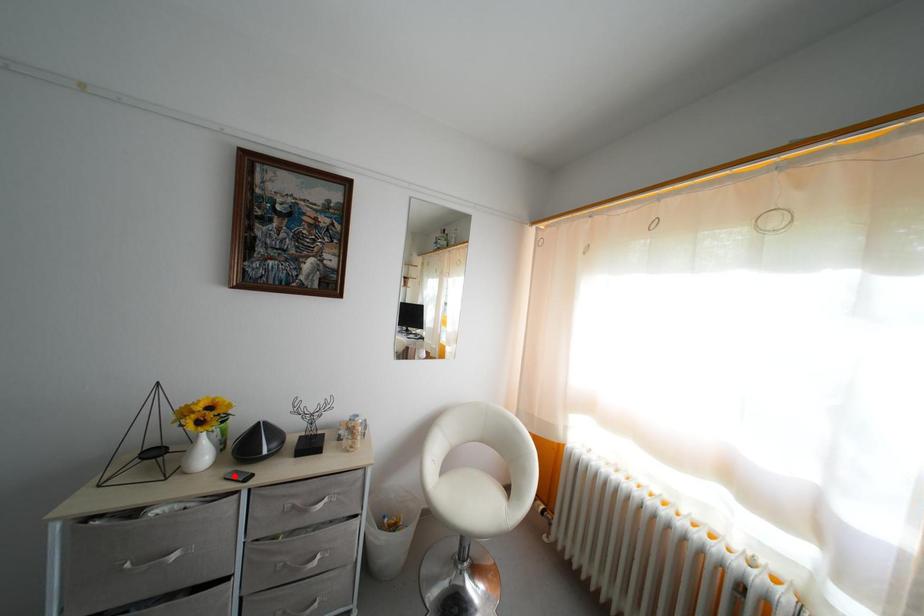
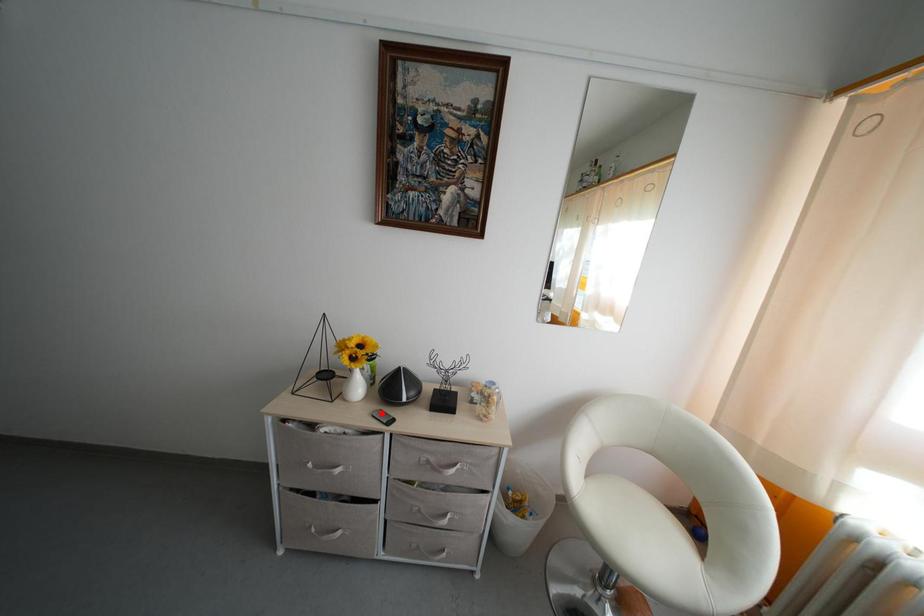
I am providing you with two images of the same scene from different viewpoints. A red point is marked on the first image and another point is marked on the second image. Is the marked point in image1 the same physical position as the marked point in image2?

Yes